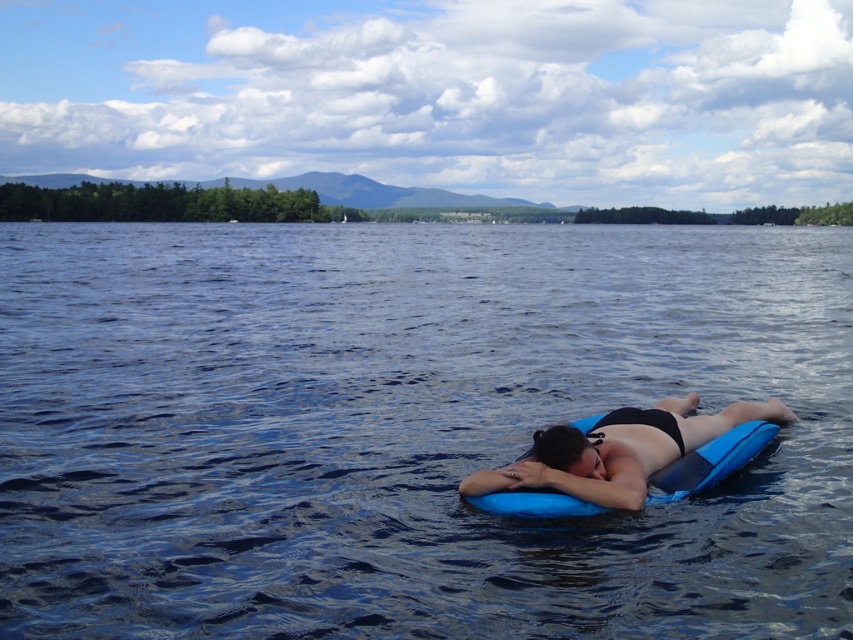
Find the location of a particular element. Image resolution: width=853 pixels, height=640 pixels. blue rubber mat at center is located at coordinates (407, 428).

Is point (782, 515) positioned in front of point (549, 460)?

No, it is behind (549, 460).

Find the location of `blue rubber mat at center`. blue rubber mat at center is located at coordinates (407, 428).